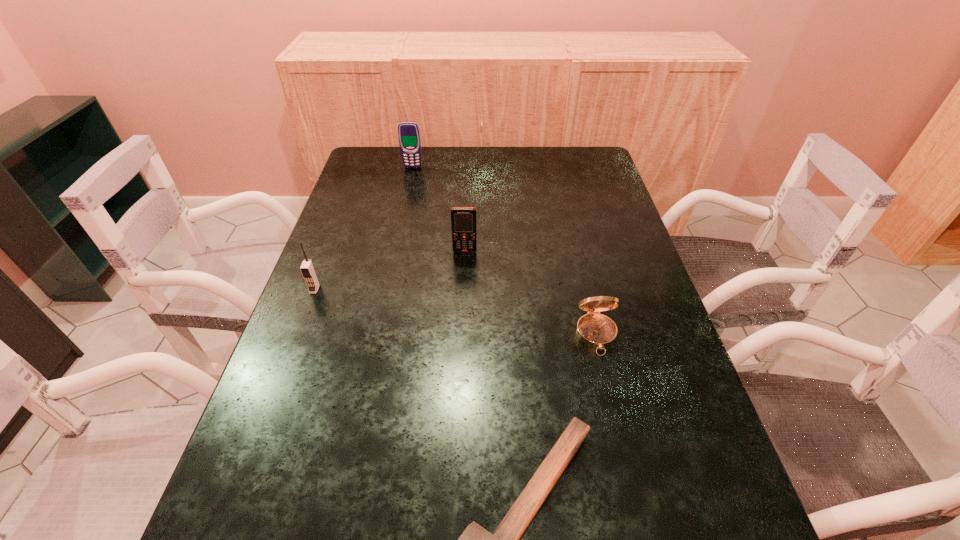
At what (x,y) coordinates should I click in order to perform the action: click on blank space located on the front-facing side of the nearest cellular telephone. Please return your answer as a coordinate pair (x, y). This screenshot has height=540, width=960. Looking at the image, I should click on (265, 422).

In order to click on blank space located 0.150m with the dial facing the fourth farthest object in this screenshot , I will do `click(616, 421)`.

Image resolution: width=960 pixels, height=540 pixels. I want to click on object located in the far edge section of the desktop, so click(x=409, y=136).

In order to click on object situated at the right edge in this screenshot , I will do (596, 331).

The width and height of the screenshot is (960, 540). I want to click on object that is at the far left corner, so click(409, 136).

Locate an element on the screen. This screenshot has height=540, width=960. vacant space at the far edge of the desktop is located at coordinates (499, 164).

I want to click on free point at the left edge, so click(x=362, y=245).

In the image, there is a desktop. In order to click on vacant area at the right edge in this screenshot , I will do `click(611, 363)`.

I want to click on vacant space at the far left corner of the desktop, so click(x=375, y=146).

Locate an element on the screen. Image resolution: width=960 pixels, height=540 pixels. free space between the farthest cellular telephone and the fourth tallest object is located at coordinates (505, 252).